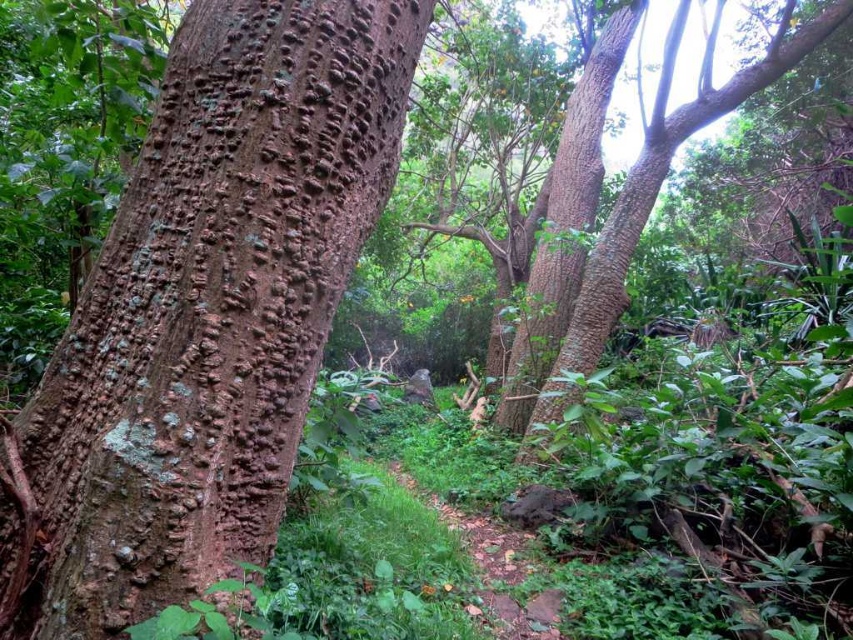
Is brown rough bark at center positioned behind smooth brown tree trunk at upper center?

No, brown rough bark at center is closer to the viewer.

Does brown rough bark at center have a larger size compared to smooth brown tree trunk at upper center?

Actually, brown rough bark at center might be smaller than smooth brown tree trunk at upper center.

Locate an element on the screen. The image size is (853, 640). brown rough bark at center is located at coordinates (204, 314).

Where is `brown rough bark at center`? The width and height of the screenshot is (853, 640). brown rough bark at center is located at coordinates (204, 314).

Is point (618, 296) positioned behind point (531, 296)?

That is False.

How distant is smooth brown tree trunk at upper right from smooth brown tree trunk at upper center?

22.73 inches

Identify the location of smooth brown tree trunk at upper right. (659, 186).

Is brown rough bark at center positioned in front of smooth brown tree trunk at upper right?

Yes, it is.

Which is more to the right, brown rough bark at center or smooth brown tree trunk at upper right?

Positioned to the right is smooth brown tree trunk at upper right.

Who is more forward, (184, 589) or (746, 76)?

Positioned in front is point (184, 589).

Find the location of a particular element. Image resolution: width=853 pixels, height=640 pixels. brown rough bark at center is located at coordinates (204, 314).